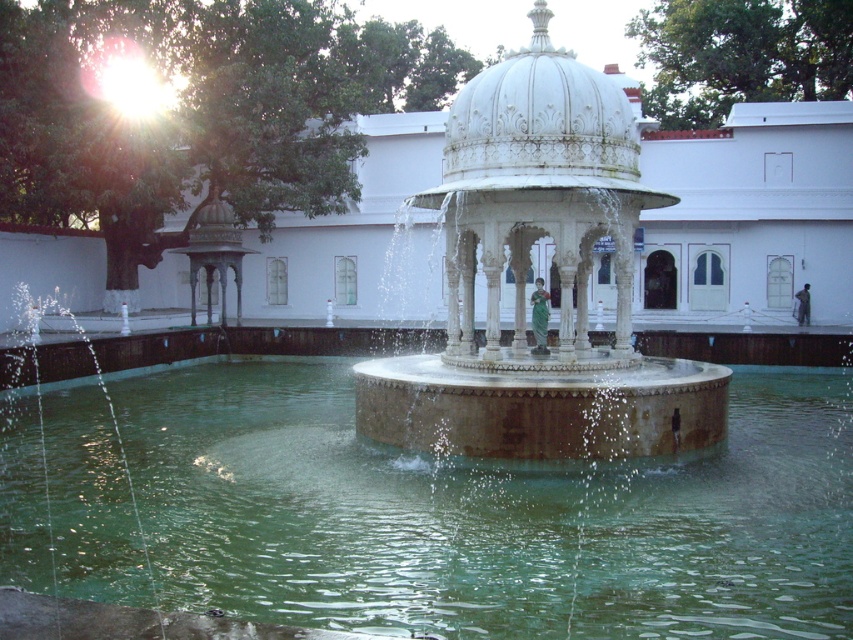
You are an architect designing a new courtyard and want to place a small decorative item between the green stone water at center and the green fabric statue at center. Since both are at the center, how can you determine where to place the item?

The green stone water at center is bigger than the green fabric statue at center, so the item should be placed closer to the smaller green fabric statue at center to balance the composition.

You are a visitor in the courtyard and want to place your dark gray fabric bag at center next to the white marble fountain at center. Considering their sizes, will the bag fit comfortably next to the fountain without overcrowding the space?

The white marble fountain at center is wider than the dark gray fabric bag at center, so placing the bag next to it should leave enough space and prevent overcrowding.

You are standing in the courtyard and want to take a photo of the white marble dome at center. If your camera can focus up to 15 meters, will you be able to capture the dome clearly?

The distance between the white marble dome at center and the camera is 16.54 meters, which exceeds the camera focus limit of 15 meters. Therefore, the dome will not be captured clearly.